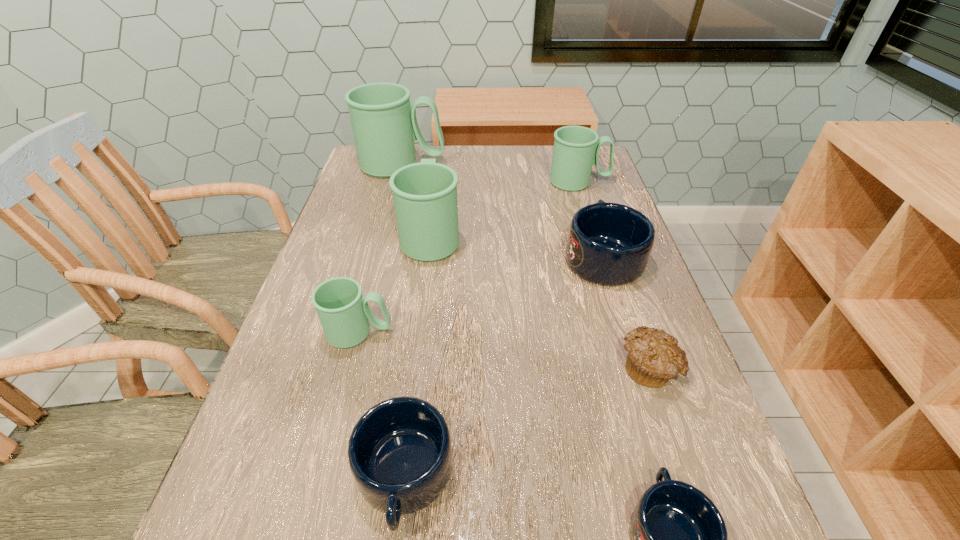
What are the coordinates of `mug that is the fourth closest one to the second shortest mug` in the screenshot? It's located at (425, 194).

Select which green mug is the third closest to the smallest green mug. Please provide its 2D coordinates. Your answer should be formatted as a tuple, i.e. [(x, y)], where the tuple contains the x and y coordinates of a point satisfying the conditions above.

[(576, 148)]

Identify which green mug is located as the third nearest to the biggest blue mug. Please provide its 2D coordinates. Your answer should be formatted as a tuple, i.e. [(x, y)], where the tuple contains the x and y coordinates of a point satisfying the conditions above.

[(343, 312)]

Locate an element on the screen. the second closest blue mug to the rightmost green mug is located at coordinates (400, 455).

Choose which blue mug is the third nearest neighbor to the nearest green mug. Please provide its 2D coordinates. Your answer should be formatted as a tuple, i.e. [(x, y)], where the tuple contains the x and y coordinates of a point satisfying the conditions above.

[(679, 538)]

You are a GUI agent. You are given a task and a screenshot of the screen. Output one action in this format:
    pyautogui.click(x=<x>, y=<y>)
    Task: Click on the free location that satisfies the following two spatial constraints: 1. on the back side of the muffin; 2. on the side of the smallest green mug with the handle
    This screenshot has height=540, width=960.
    Given the screenshot: What is the action you would take?
    pyautogui.click(x=636, y=332)

Locate an element on the screen. This screenshot has width=960, height=540. vacant area that satisfies the following two spatial constraints: 1. on the side of the fifth shortest mug with the handle; 2. on the left side of the muffin is located at coordinates (637, 368).

This screenshot has height=540, width=960. I want to click on vacant space that satisfies the following two spatial constraints: 1. on the side of the tallest object with the handle; 2. with the handle on the side of the biggest blue mug, so click(378, 256).

Where is `vacant area that satisfies the following two spatial constraints: 1. on the side of the third farthest green mug with the handle; 2. on the side of the tallest object with the handle`? vacant area that satisfies the following two spatial constraints: 1. on the side of the third farthest green mug with the handle; 2. on the side of the tallest object with the handle is located at coordinates (441, 165).

Locate an element on the screen. vacant region that satisfies the following two spatial constraints: 1. on the side of the second tallest object with the handle; 2. on the side of the tallest object with the handle is located at coordinates pos(441,165).